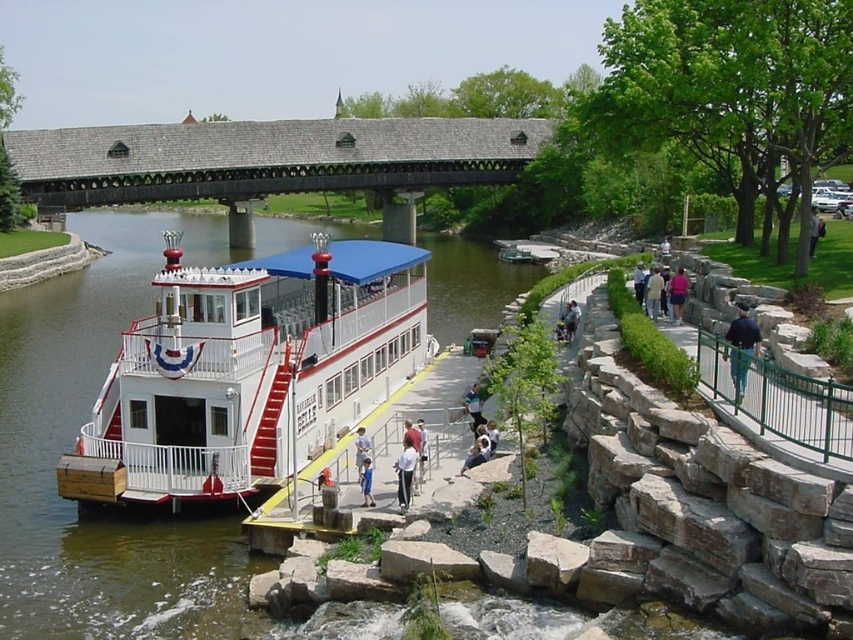
Question: Among these objects, which one is nearest to the camera?

Choices:
 (A) pink fabric shirt at center-right
 (B) greenish-brown water at lower left

Answer: (B)

Question: Which point appears closest to the camera in this image?

Choices:
 (A) (809, 241)
 (B) (357, 451)
 (C) (219, 344)

Answer: (C)

Question: Is white matte boat at center closer to the viewer compared to greenish-brown water at lower left?

Choices:
 (A) yes
 (B) no

Answer: (B)

Question: Does dark blue fabric jacket at right appear under pink fabric bag at upper center?

Choices:
 (A) yes
 (B) no

Answer: (A)

Question: Which point is closer to the camera?

Choices:
 (A) (354, 442)
 (B) (364, 483)

Answer: (B)

Question: Can you confirm if white fabric shirt at lower center is positioned to the left of pink fabric bag at upper center?

Choices:
 (A) no
 (B) yes

Answer: (B)